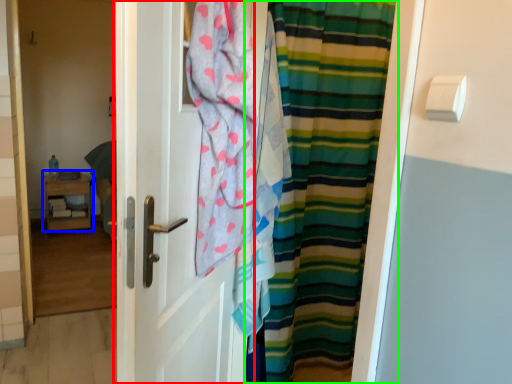
Question: Which is farther away from door (highlighted by a red box)? furniture (highlighted by a blue box) or curtain (highlighted by a green box)?

Choices:
 (A) furniture
 (B) curtain

Answer: (A)